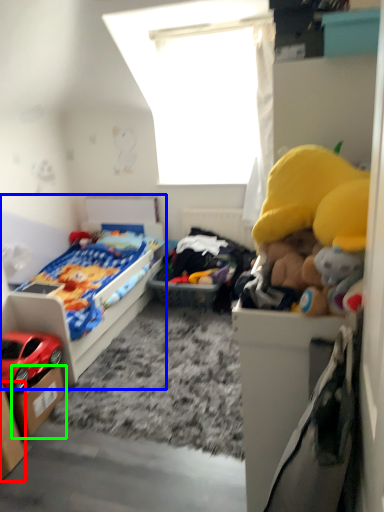
Question: Which is nearer to the storage box (highlighted by a red box)? bed (highlighted by a blue box) or storage box (highlighted by a green box).

Choices:
 (A) bed
 (B) storage box

Answer: (B)